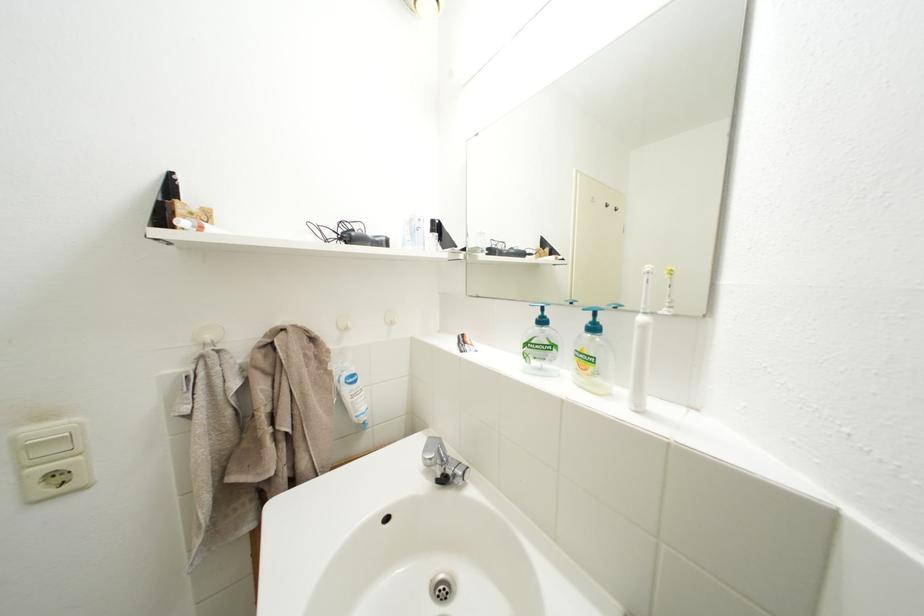
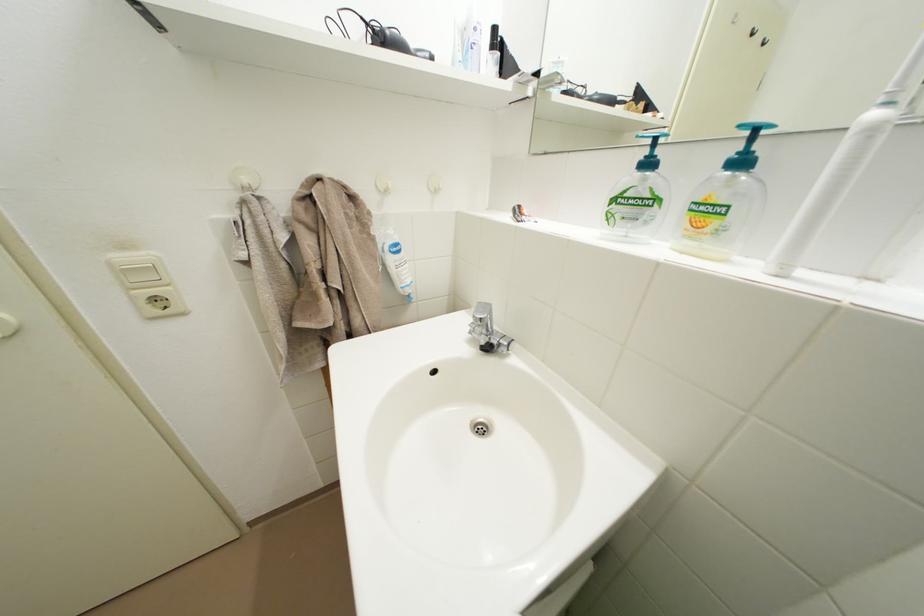
The images are taken continuously from a first-person perspective. In which direction are you moving?

The movement direction of the cameraman is left, forward.